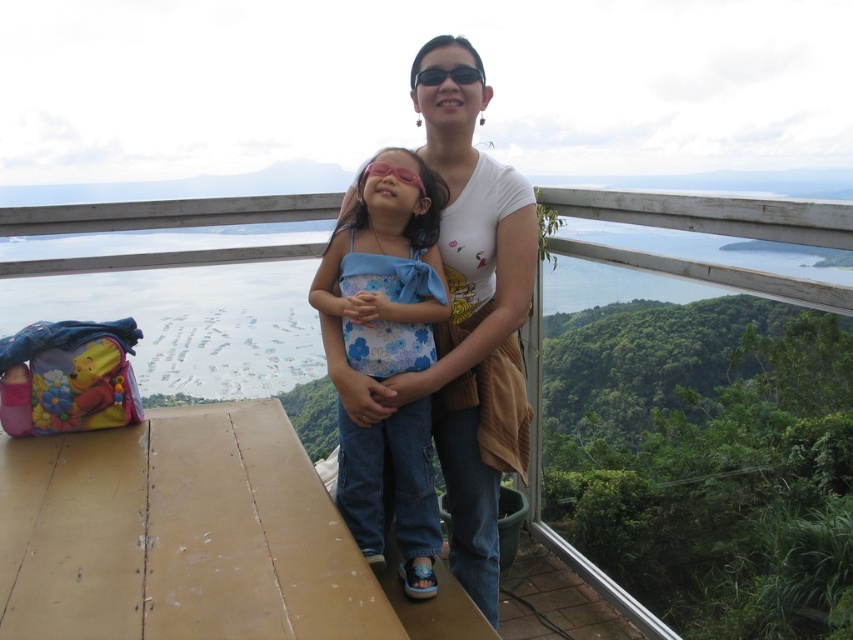
Which of these two, white cotton shirt at center or floral fabric swimsuit at center, stands taller?

white cotton shirt at center is taller.

Who is more distant from viewer, [408,400] or [372,209]?

Point [408,400]

Where is `white cotton shirt at center`? white cotton shirt at center is located at coordinates (466, 316).